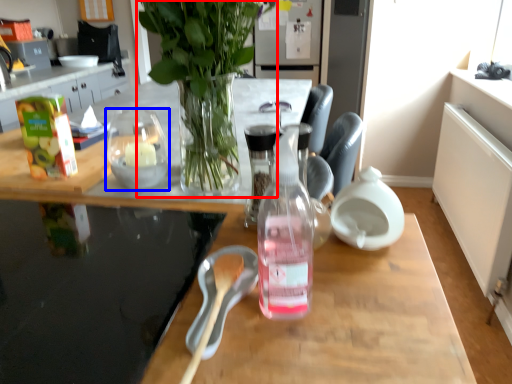
Question: Among these objects, which one is nearest to the camera, houseplant (highlighted by a red box) or tableware (highlighted by a blue box)?

Choices:
 (A) houseplant
 (B) tableware

Answer: (A)